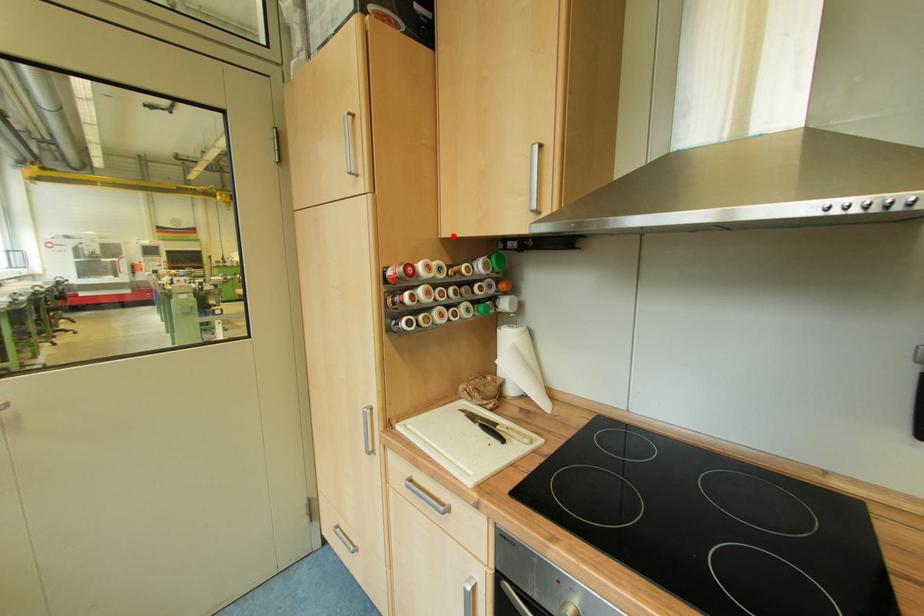
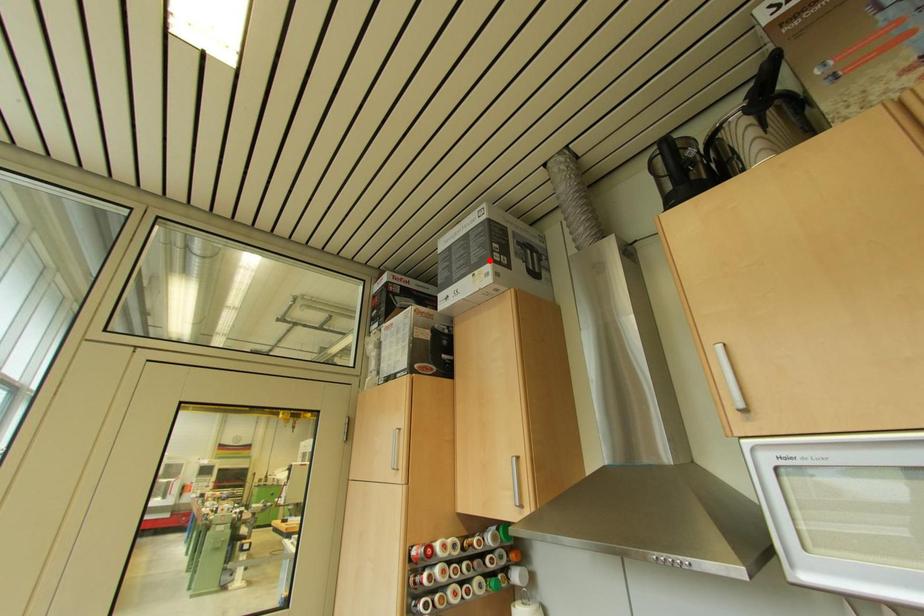
I am providing you with two images of the same scene from different viewpoints. A red point is marked on the first image and another point is marked on the second image. Are the points marked in image1 and image2 representing the same 3D position?

No